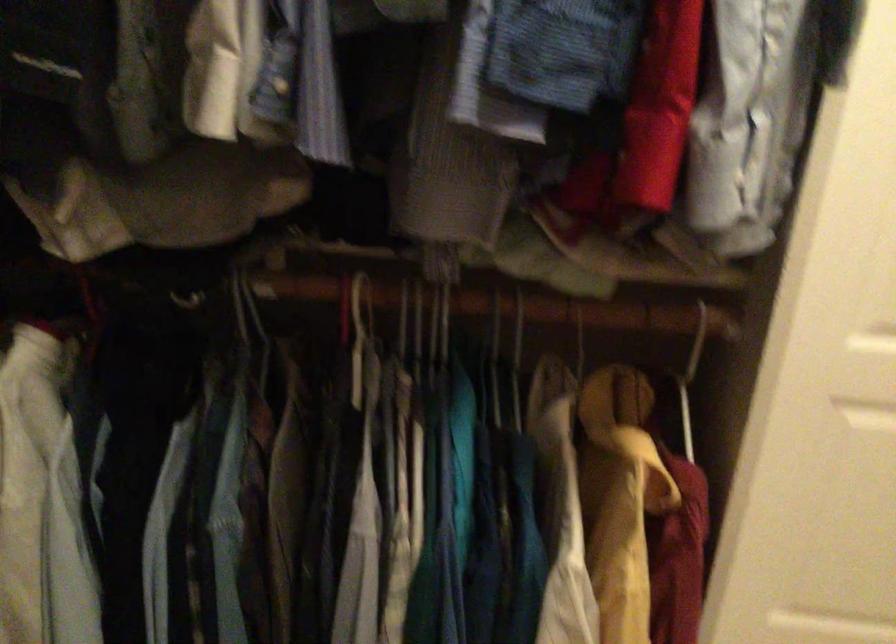
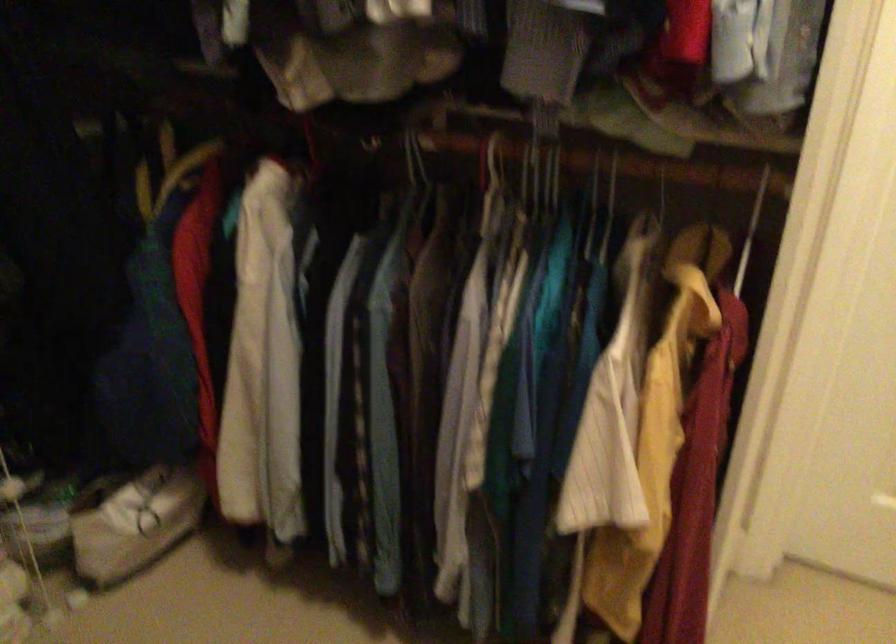
Find the pixel in the second image that matches point (359, 310) in the first image.

(494, 161)